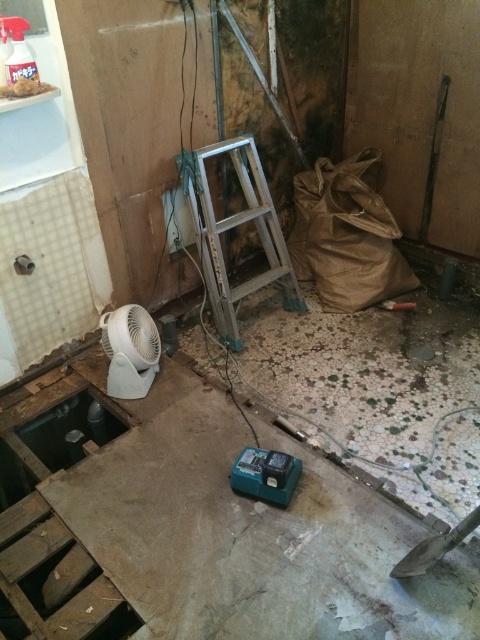
Question: Which point is farther to the camera?

Choices:
 (A) (219, 273)
 (B) (60, 403)
 (C) (434, 547)
 (D) (296, 468)

Answer: (A)

Question: Where is green plastic tool at center located in relation to green plastic power tool at center in the image?

Choices:
 (A) below
 (B) above

Answer: (A)

Question: Which object is farther from the camera taking this photo?

Choices:
 (A) green plastic tool at center
 (B) green plastic power tool at center
 (C) metallic silver shovel at lower right
 (D) silver metallic ladder at center

Answer: (D)

Question: Which of these objects is positioned closest to the silver metallic ladder at center?

Choices:
 (A) green plastic power tool at center
 (B) green plastic tool at center
 (C) metallic silver shovel at lower right

Answer: (B)

Question: Is silver metallic ladder at center smaller than metallic silver shovel at lower right?

Choices:
 (A) yes
 (B) no

Answer: (B)

Question: Is green plastic power tool at center to the right of metallic silver shovel at lower right from the viewer's perspective?

Choices:
 (A) no
 (B) yes

Answer: (A)